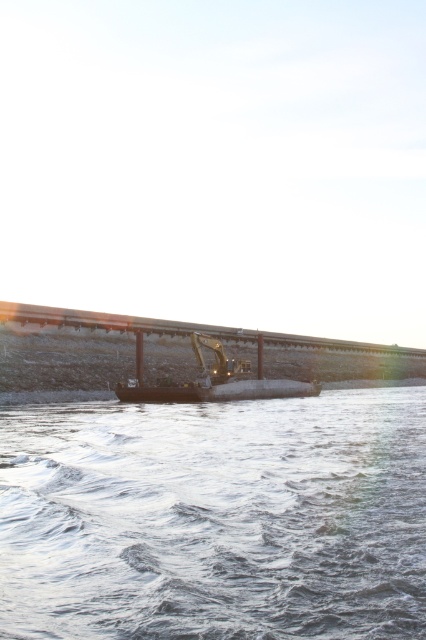
You are a construction worker standing on the metallic yellow excavator at center. You want to pour some materials into the clear water at lower center. Can you reach the water surface with your tools?

The clear water at lower center is shorter than the metallic yellow excavator at center, so yes, you can reach the water surface with your tools since the excavator is taller than the water level.

Based on the photo, you are standing on the bridge looking down at the river. You notice a point marked at coordinates (x=215, y=518). Based on the scene description, what can you observe at that location?

At the coordinates (x=215, y=518), you can observe clear water at lower center.

Looking at this image, you are standing on the bridge and see the point marked at coordinates (215,518). What is located at that point?

The point at coordinates (215,518) has clear water at lower center.